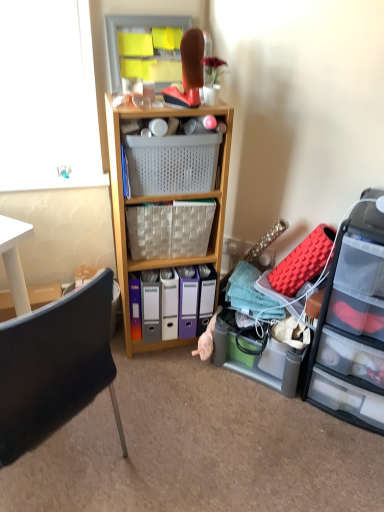
Where is `vacant space that's between black plastic chair at lower left and clear plastic drawers at right`? This screenshot has height=512, width=384. vacant space that's between black plastic chair at lower left and clear plastic drawers at right is located at coordinates (219, 435).